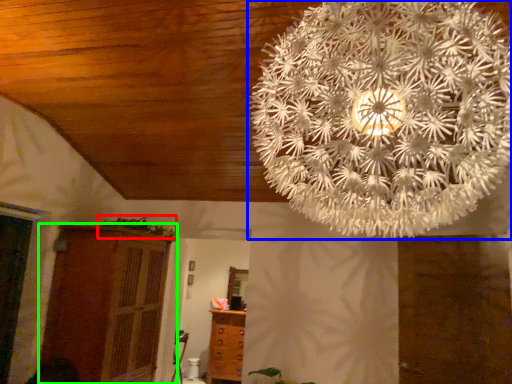
Question: Considering the real-world distances, which object is closest to plant (highlighted by a red box)? lamp (highlighted by a blue box) or cupboard (highlighted by a green box).

Choices:
 (A) lamp
 (B) cupboard

Answer: (B)